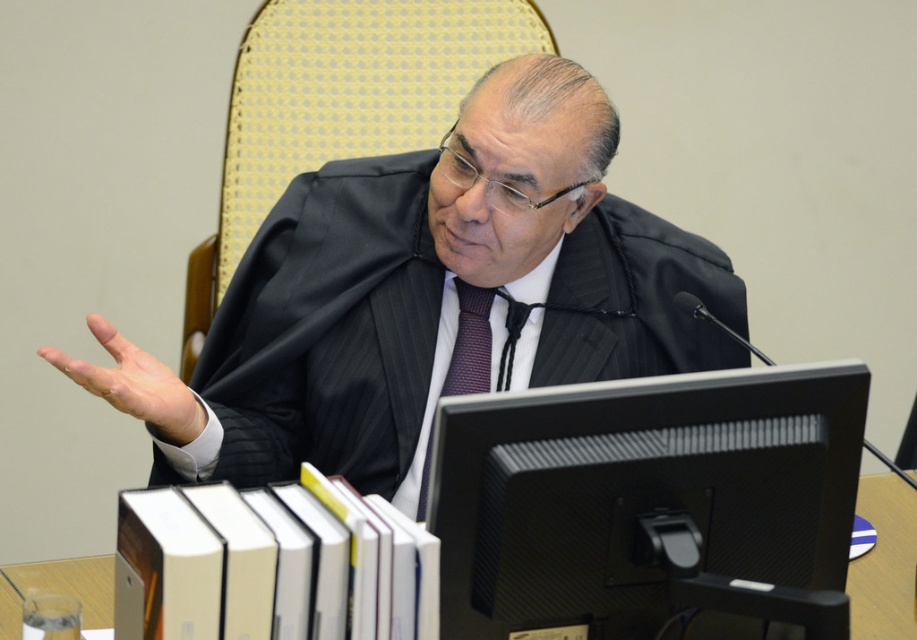
You are a legal assistant who needs to place a document on the desk. The document must be placed on the white paper at lower center. However, there is a black matte computer monitor at center in the way. Can you move the monitor to access the paper?

The black matte computer monitor at center is positioned over white paper at lower center, so moving the monitor would allow access to the paper.